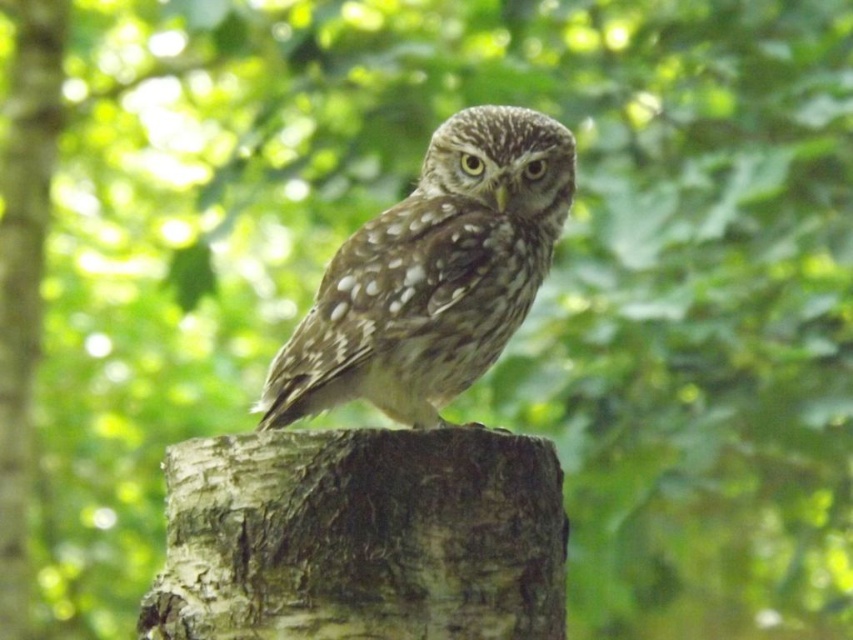
Question: Can you confirm if rough bark stump at center is thinner than smooth bark tree trunk at center?

Choices:
 (A) no
 (B) yes

Answer: (A)

Question: Can you confirm if rough bark stump at center is thinner than speckled feathered owl at center?

Choices:
 (A) no
 (B) yes

Answer: (B)

Question: Estimate the real-world distances between objects in this image. Which object is farther from the rough bark stump at center?

Choices:
 (A) speckled feathered owl at center
 (B) smooth bark tree trunk at center

Answer: (B)

Question: Which is nearer to the speckled feathered owl at center?

Choices:
 (A) smooth bark tree trunk at center
 (B) rough bark stump at center

Answer: (B)

Question: Is rough bark stump at center above speckled feathered owl at center?

Choices:
 (A) no
 (B) yes

Answer: (A)

Question: Which point is farther to the camera?

Choices:
 (A) (32, 323)
 (B) (444, 225)

Answer: (A)